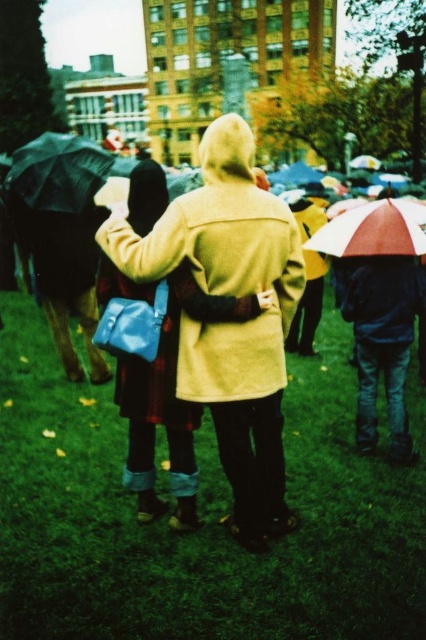
You are a photographer trying to capture a photo of the matte yellow trench coat at center and the translucent plastic umbrella at right without any obstructions. Given that your camera has a maximum focus range of 3 meters, will you be able to fit both subjects in the frame while keeping them in focus?

The matte yellow trench coat at center and the translucent plastic umbrella at right are 2.86 meters apart from each other. Since the distance between them is within the camera maximum focus range of 3 meters, you can fit both subjects in the frame while keeping them in focus.

Looking at this image, you are a photographer trying to capture a closeup of the matte yellow trench coat at center without including the green grass at center in the frame. Is this possible given their sizes?

The green grass at center is larger in size than the matte yellow trench coat at center, so it might be challenging to exclude the green grass at center from the frame due to its larger area.